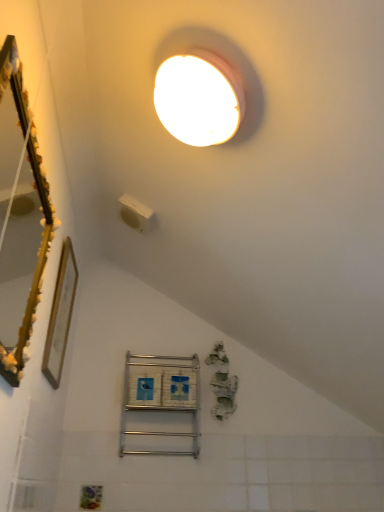
The width and height of the screenshot is (384, 512). Describe the element at coordinates (20, 217) in the screenshot. I see `gold textured mirror at left` at that location.

In order to face white plastic light switch at upper center, should I rotate leftwards or rightwards?

Rotate left and turn 7.605 degrees.

In order to click on metallic silver shelf at center in this screenshot , I will do `click(161, 396)`.

Where is `gold wooden picture frame at left`? Image resolution: width=384 pixels, height=512 pixels. gold wooden picture frame at left is located at coordinates (60, 315).

Based on the photo, measure the distance between point (48, 348) and camera.

Point (48, 348) and camera are 4.86 feet apart from each other.

Identify the location of gold textured mirror at left. The height and width of the screenshot is (512, 384). (20, 217).

Locate an element on the screen. The height and width of the screenshot is (512, 384). picture frame above the metallic silver shelf at center (from the image's perspective) is located at coordinates (60, 315).

Based on the photo, is the depth of gold wooden picture frame at left greater than that of metallic silver shelf at center?

No, it is not.

Does gold wooden picture frame at left turn towards metallic silver shelf at center?

No, gold wooden picture frame at left is not aimed at metallic silver shelf at center.

Which is correct: gold wooden picture frame at left is inside metallic silver shelf at center, or outside of it?

gold wooden picture frame at left lies outside metallic silver shelf at center.

Looking at this image, which is in front, white plastic light switch at upper center or gold textured mirror at left?

gold textured mirror at left is in front.

Is white plastic light switch at upper center spatially inside gold textured mirror at left, or outside of it?

The correct answer is: outside.

Is point (143, 221) farther from camera compared to point (2, 272)?

No, (143, 221) is closer to viewer.

From the picture: Can you tell me how much white plastic light switch at upper center and gold textured mirror at left differ in facing direction?

white plastic light switch at upper center and gold textured mirror at left are facing 0.641 degrees away from each other.

Is gold wooden picture frame at left oriented towards gold textured mirror at left?

No, gold wooden picture frame at left is not facing towards gold textured mirror at left.

Is point (57, 382) closer to viewer compared to point (7, 201)?

No, it is behind (7, 201).

Considering the relative sizes of gold wooden picture frame at left and gold textured mirror at left in the image provided, is gold wooden picture frame at left thinner than gold textured mirror at left?

Correct, the width of gold wooden picture frame at left is less than that of gold textured mirror at left.

Relative to gold textured mirror at left, is gold wooden picture frame at left in front or behind?

Clearly, gold wooden picture frame at left is behind gold textured mirror at left.

Between metallic silver shelf at center and white plastic light switch at upper center, which one has smaller size?

Smaller between the two is white plastic light switch at upper center.

How many degrees apart are the facing directions of metallic silver shelf at center and white plastic light switch at upper center?

metallic silver shelf at center and white plastic light switch at upper center are facing 90.2 degrees away from each other.

Would you say metallic silver shelf at center is outside white plastic light switch at upper center?

metallic silver shelf at center lies outside white plastic light switch at upper center's area.

Between metallic silver shelf at center and white plastic light switch at upper center, which one appears on the left side from the viewer's perspective?

From the viewer's perspective, white plastic light switch at upper center appears more on the left side.

Based on the photo, which object is further away from the camera taking this photo, gold wooden picture frame at left or white plastic light switch at upper center?

white plastic light switch at upper center is more distant.

Is gold wooden picture frame at left wider or thinner than white plastic light switch at upper center?

Considering their sizes, gold wooden picture frame at left looks slimmer than white plastic light switch at upper center.

Where is `picture frame in front of the white plastic light switch at upper center`? This screenshot has width=384, height=512. picture frame in front of the white plastic light switch at upper center is located at coordinates (60, 315).

From a real-world perspective, is white plastic light switch at upper center under metallic silver shelf at center?

Actually, white plastic light switch at upper center is physically above metallic silver shelf at center in the real world.

From the image's perspective, which is below, white plastic light switch at upper center or metallic silver shelf at center?

metallic silver shelf at center, from the image's perspective.

Is white plastic light switch at upper center in front of or behind metallic silver shelf at center in the image?

Clearly, white plastic light switch at upper center is in front of metallic silver shelf at center.

Is white plastic light switch at upper center not close to metallic silver shelf at center?

That's not correct — white plastic light switch at upper center is a little close to metallic silver shelf at center.

Find the location of a particular element. light switch behind the gold wooden picture frame at left is located at coordinates (134, 212).

Is white plastic light switch at upper center spatially inside gold wooden picture frame at left, or outside of it?

white plastic light switch at upper center lies outside gold wooden picture frame at left.

Between white plastic light switch at upper center and gold wooden picture frame at left, which one appears on the left side from the viewer's perspective?

From the viewer's perspective, gold wooden picture frame at left appears more on the left side.

Considering the sizes of objects white plastic light switch at upper center and gold wooden picture frame at left in the image provided, who is taller, white plastic light switch at upper center or gold wooden picture frame at left?

gold wooden picture frame at left is taller.

The height and width of the screenshot is (512, 384). I want to click on picture frame to the left of metallic silver shelf at center, so click(60, 315).

Where is `light switch above the gold textured mirror at left (from a real-world perspective)`? light switch above the gold textured mirror at left (from a real-world perspective) is located at coordinates (134, 212).

Considering their positions, is metallic silver shelf at center positioned further to white plastic light switch at upper center than gold wooden picture frame at left?

metallic silver shelf at center is positioned further to the anchor white plastic light switch at upper center.

From the image, which object appears to be farther from metallic silver shelf at center, gold wooden picture frame at left or gold textured mirror at left?

Among the two, gold textured mirror at left is located further to metallic silver shelf at center.

Based on their spatial positions, is gold wooden picture frame at left or white plastic light switch at upper center further from gold textured mirror at left?

white plastic light switch at upper center.

Considering their positions, is gold wooden picture frame at left positioned further to metallic silver shelf at center than white plastic light switch at upper center?

white plastic light switch at upper center is further to metallic silver shelf at center.

From the image, which object appears to be farther from gold textured mirror at left, metallic silver shelf at center or white plastic light switch at upper center?

metallic silver shelf at center is further to gold textured mirror at left.

Which object lies nearer to the anchor point gold textured mirror at left, gold wooden picture frame at left or metallic silver shelf at center?

gold wooden picture frame at left is closer to gold textured mirror at left.

Based on their spatial positions, is metallic silver shelf at center or gold wooden picture frame at left further from gold textured mirror at left?

metallic silver shelf at center is further to gold textured mirror at left.

Which object lies further to the anchor point metallic silver shelf at center, white plastic light switch at upper center or gold wooden picture frame at left?

white plastic light switch at upper center is further to metallic silver shelf at center.

You are a GUI agent. You are given a task and a screenshot of the screen. Output one action in this format:
    pyautogui.click(x=<x>, y=<y>)
    Task: Click on the picture frame positioned between gold textured mirror at left and metallic silver shelf at center from near to far
    The height and width of the screenshot is (512, 384).
    Given the screenshot: What is the action you would take?
    [60, 315]

Where is `picture frame between white plastic light switch at upper center and metallic silver shelf at center in the up-down direction`? picture frame between white plastic light switch at upper center and metallic silver shelf at center in the up-down direction is located at coordinates (60, 315).

Image resolution: width=384 pixels, height=512 pixels. Identify the location of light switch between gold textured mirror at left and metallic silver shelf at center in the front-back direction. (134, 212).

You are a GUI agent. You are given a task and a screenshot of the screen. Output one action in this format:
    pyautogui.click(x=<x>, y=<y>)
    Task: Click on the picture frame between gold textured mirror at left and white plastic light switch at upper center from front to back
    The image size is (384, 512).
    Given the screenshot: What is the action you would take?
    pyautogui.click(x=60, y=315)